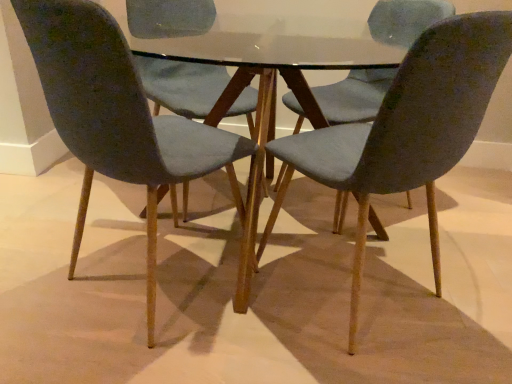
Locate an element on the screen. The height and width of the screenshot is (384, 512). empty space that is to the right of matte blue chair at center, which is the first chair from right to left is located at coordinates (460, 286).